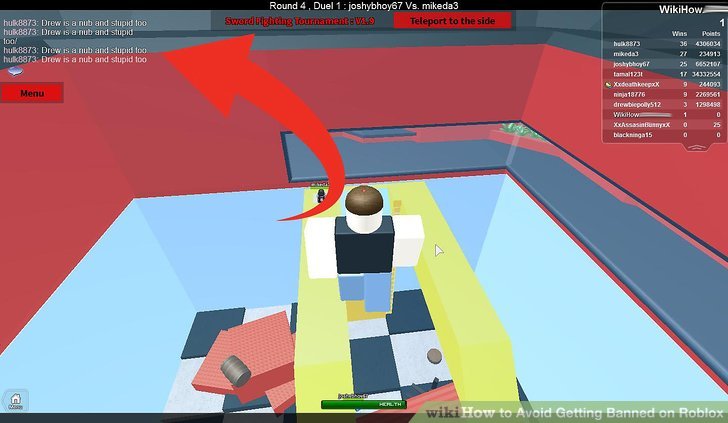
This screenshot has height=423, width=728. What are the coordinates of `yellow hallway` in the screenshot? It's located at (312, 312), (443, 308).